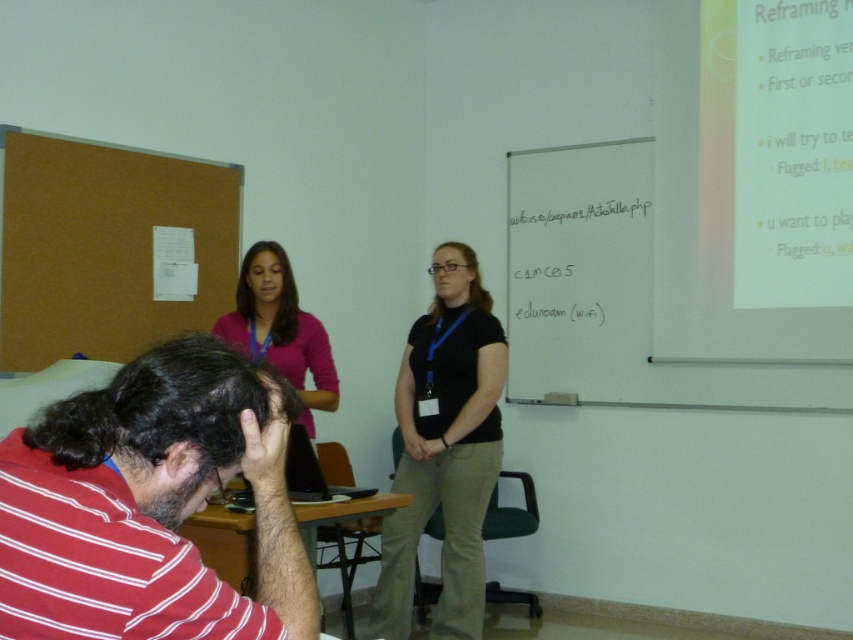
Which is above, whiteboard at right or pink fabric shirt at upper center?

Positioned higher is whiteboard at right.

Is whiteboard at right to the right of pink fabric shirt at upper center from the viewer's perspective?

Correct, you'll find whiteboard at right to the right of pink fabric shirt at upper center.

Image resolution: width=853 pixels, height=640 pixels. What are the coordinates of `whiteboard at right` in the screenshot? It's located at (618, 296).

This screenshot has height=640, width=853. Identify the location of whiteboard at right. (618, 296).

Who is shorter, whiteboard at right or black matte shirt at center?

With less height is whiteboard at right.

Identify the location of whiteboard at right. Image resolution: width=853 pixels, height=640 pixels. (618, 296).

Where is `black matte shirt at center`? black matte shirt at center is located at coordinates (444, 449).

Is black matte shirt at center positioned in front of pink fabric shirt at upper center?

No, black matte shirt at center is further to the viewer.

Which is behind, point (468, 275) or point (273, 314)?

The point (468, 275) is more distant.

The height and width of the screenshot is (640, 853). I want to click on black matte shirt at center, so click(444, 449).